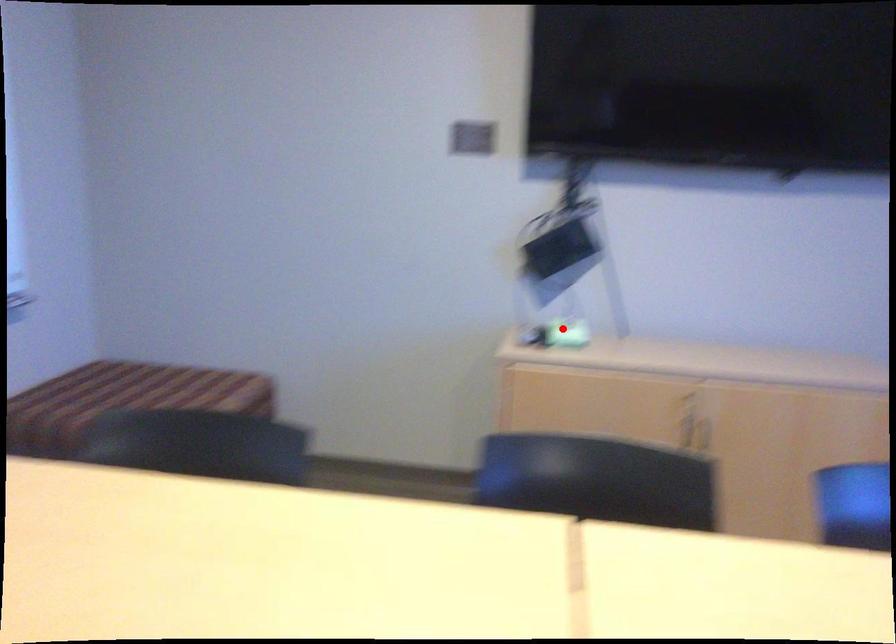
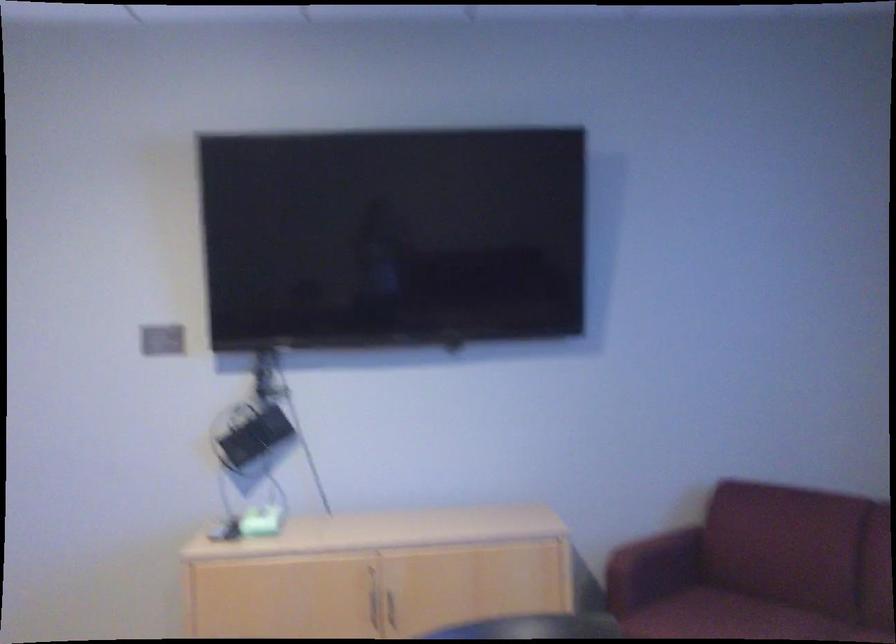
Question: I am providing you with two images of the same scene from different viewpoints. A red point is marked on the first image. Can you still see the location of the red point in image 2?

Choices:
 (A) Yes
 (B) No

Answer: (A)